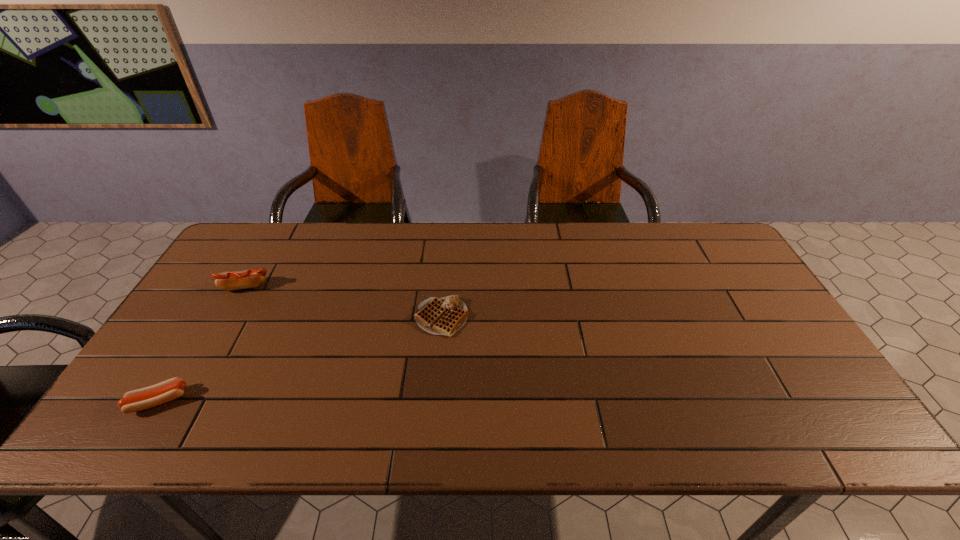
Image resolution: width=960 pixels, height=540 pixels. What are the coordinates of `unoccupied position between the nearer sausage and the farther sausage` in the screenshot? It's located at (202, 344).

In order to click on vacant space that is in between the farthest object and the nearer sausage in this screenshot , I will do `click(202, 344)`.

The image size is (960, 540). Find the location of `empty space between the farthest object and the nearest object`. empty space between the farthest object and the nearest object is located at coordinates (202, 344).

Find the location of a particular element. This screenshot has height=540, width=960. unoccupied area between the farther sausage and the second nearest object is located at coordinates (344, 302).

The image size is (960, 540). Identify the location of vacant space in between the taller sausage and the nearer sausage. (202, 344).

Where is `object that stands as the closest to the farther sausage`? object that stands as the closest to the farther sausage is located at coordinates (148, 397).

Locate an element on the screen. Image resolution: width=960 pixels, height=540 pixels. object that stands as the closest to the farther sausage is located at coordinates (148, 397).

Where is `free spot that satisfies the following two spatial constraints: 1. on the front side of the shortest object; 2. on the left side of the farthest object`? free spot that satisfies the following two spatial constraints: 1. on the front side of the shortest object; 2. on the left side of the farthest object is located at coordinates (228, 318).

Identify the location of vacant space that satisfies the following two spatial constraints: 1. on the front side of the rightmost object; 2. on the right side of the farther sausage. (228, 318).